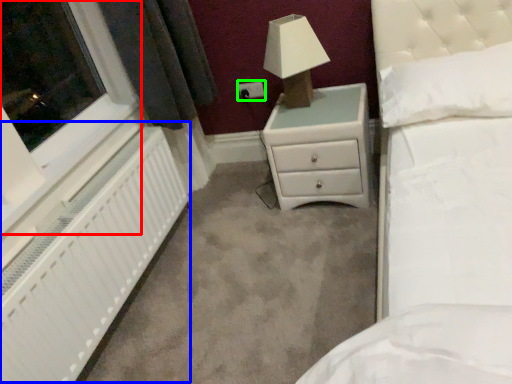
Question: Considering the real-world distances, which object is farthest from window (highlighted by a red box)? radiator (highlighted by a blue box) or electric outlet (highlighted by a green box)?

Choices:
 (A) radiator
 (B) electric outlet

Answer: (B)